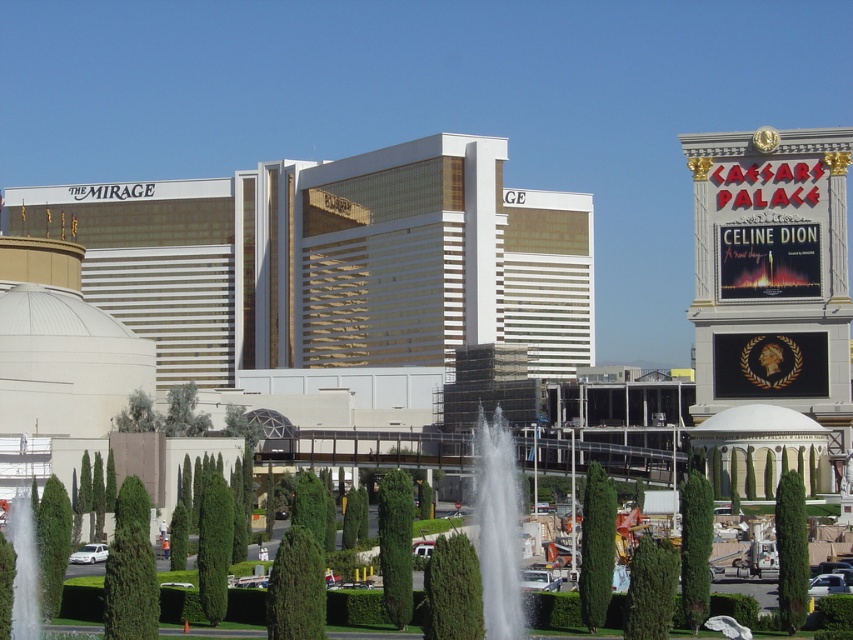
You are a photographer planning to capture both the white glossy building at center and the gold reflective building at center in a single shot. Given that your camera has a limited field of view, which building should you position closer to the center of your frame to ensure both are fully visible?

The white glossy building at center is larger in size than the gold reflective building at center. To ensure both are fully visible in your shot, position the white glossy building at center closer to the center of your frame since its larger size requires more space within the limited field of view.

You are a photographer planning to capture the gold reflective building at center and the white water at center in a single shot. Based on their sizes, which object should you focus on to ensure both are visible without cropping?

The gold reflective building at center is wider than the white water at center, so focusing on the gold reflective building at center will ensure both are visible without cropping.

You are a photographer planning to capture a wide shot of the scene. You notice the white glossy building at center and the white water at center. Which object should you focus on to ensure it occupies more space in your photo?

The white glossy building at center has a larger width than the white water at center, so focusing on it will ensure it occupies more space in the photo.